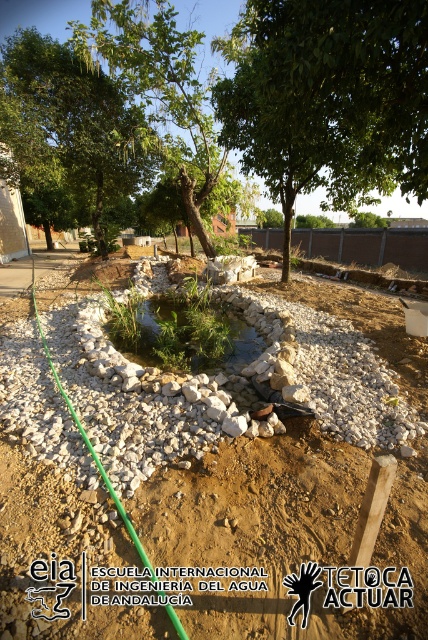
Question: Is green leafy tree at center to the left of green grassy pond at center from the viewer's perspective?

Choices:
 (A) yes
 (B) no

Answer: (B)

Question: Is white gravel pond at center closer to the viewer compared to green leafy tree at center?

Choices:
 (A) no
 (B) yes

Answer: (B)

Question: Does white gravel pond at center come behind green leafy tree at upper left?

Choices:
 (A) yes
 (B) no

Answer: (B)

Question: Estimate the real-world distances between objects in this image. Which object is closer to the white gravel pond at center?

Choices:
 (A) green grassy pond at center
 (B) green leafy tree at center
 (C) green leafy tree at upper left

Answer: (A)

Question: Based on their relative distances, which object is farther from the green leafy tree at center?

Choices:
 (A) green leafy tree at upper center
 (B) green grassy pond at center

Answer: (B)

Question: Considering the real-world distances, which object is farthest from the green leafy tree at upper left?

Choices:
 (A) green leafy tree at upper center
 (B) white gravel pond at center
 (C) green grassy pond at center

Answer: (B)